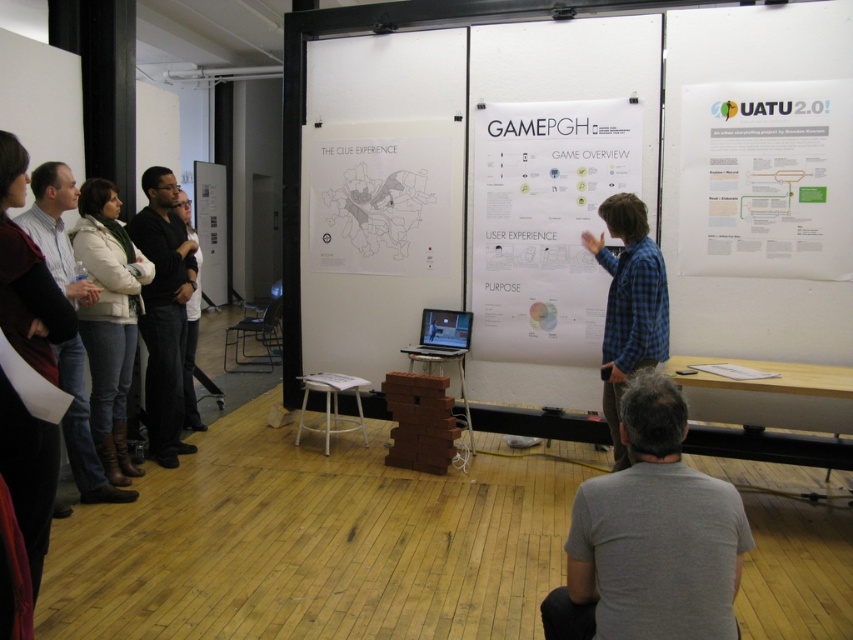
Which is more to the right, white paper poster at center or white paper poster at upper right?

From the viewer's perspective, white paper poster at upper right appears more on the right side.

What do you see at coordinates (544, 224) in the screenshot? I see `white paper poster at center` at bounding box center [544, 224].

You are a GUI agent. You are given a task and a screenshot of the screen. Output one action in this format:
    pyautogui.click(x=<x>, y=<y>)
    Task: Click on the white paper poster at center
    The width and height of the screenshot is (853, 640).
    Given the screenshot: What is the action you would take?
    [x=544, y=224]

The image size is (853, 640). Describe the element at coordinates (164, 310) in the screenshot. I see `dark blue jeans at left` at that location.

Is dark blue jeans at left shorter than black leather jacket at left?

No.

Between point (166, 380) and point (189, 365), which one is positioned in front?

Point (166, 380)

You are a GUI agent. You are given a task and a screenshot of the screen. Output one action in this format:
    pyautogui.click(x=<x>, y=<y>)
    Task: Click on the dark blue jeans at left
    The height and width of the screenshot is (640, 853).
    Given the screenshot: What is the action you would take?
    pyautogui.click(x=164, y=310)

Between point (138, 256) and point (135, 241), which one is positioned in front?

Point (138, 256)

Measure the distance between point (125, 285) and camera.

12.28 feet

I want to click on white knit sweater at left, so click(x=109, y=317).

At what (x,y) coordinates should I click in order to perform the action: click on white knit sweater at left. Please return your answer as a coordinate pair (x, y). Looking at the image, I should click on (109, 317).